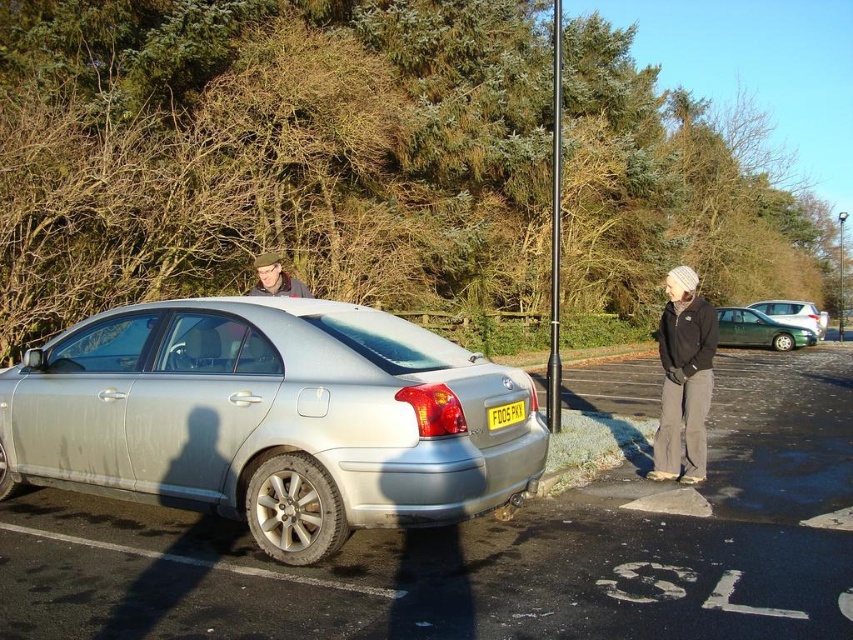
Which is above, metallic silver pole at center or yellow matte license plate at center?

metallic silver pole at center

Does metallic silver pole at center have a lesser height compared to yellow matte license plate at center?

In fact, metallic silver pole at center may be taller than yellow matte license plate at center.

What do you see at coordinates (554, 234) in the screenshot?
I see `metallic silver pole at center` at bounding box center [554, 234].

This screenshot has height=640, width=853. Identify the location of metallic silver pole at center. (554, 234).

Is point (770, 310) more distant than point (488, 410)?

Yes, point (770, 310) is behind point (488, 410).

Who is taller, green matte car at right or yellow matte license plate at center?

green matte car at right is taller.

Identify the location of green matte car at right. (793, 314).

Can you confirm if metallic silver pole at center is positioned below green matte car at right?

No.

Does metallic silver pole at center have a lesser width compared to green matte car at right?

Correct, metallic silver pole at center's width is less than green matte car at right's.

Which is in front, point (549, 384) or point (763, 310)?

Positioned in front is point (549, 384).

Find the location of a particular element. The image size is (853, 640). metallic silver pole at center is located at coordinates (554, 234).